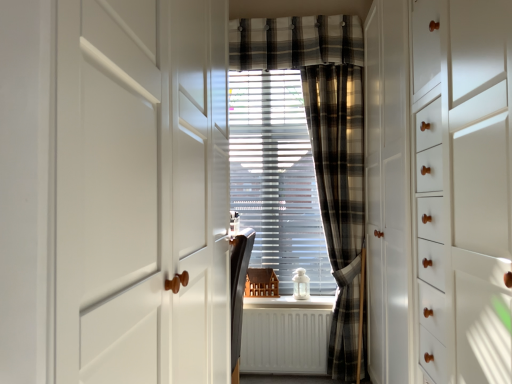
Question: Considering the relative positions of matte black chair at center, the first furniture positioned from the front, and white glossy window sill at center in the image provided, is matte black chair at center, the first furniture positioned from the front, to the left or to the right of white glossy window sill at center?

Choices:
 (A) right
 (B) left

Answer: (B)

Question: Is matte black chair at center, the first furniture positioned from the front, wider or thinner than white glossy window sill at center?

Choices:
 (A) wide
 (B) thin

Answer: (B)

Question: Which object is positioned farthest from the white matte cabinet at right, which is the first door in right-to-left order?

Choices:
 (A) plaid fabric curtain at center
 (B) white matte radiator at center
 (C) plaid fabric curtain at center
 (D) white plastic blinds at center
 (E) wooden miniature house at center, the 1th furniture when ordered from back to front

Answer: (E)

Question: Which object is the farthest from the white glossy window sill at center?

Choices:
 (A) plaid fabric curtain at center
 (B) wooden miniature house at center, the 1th furniture when ordered from back to front
 (C) matte black chair at center, which ranks as the 2th furniture in back-to-front order
 (D) white matte door at left, the 2th door viewed from the right
 (E) white plastic toy at center

Answer: (D)